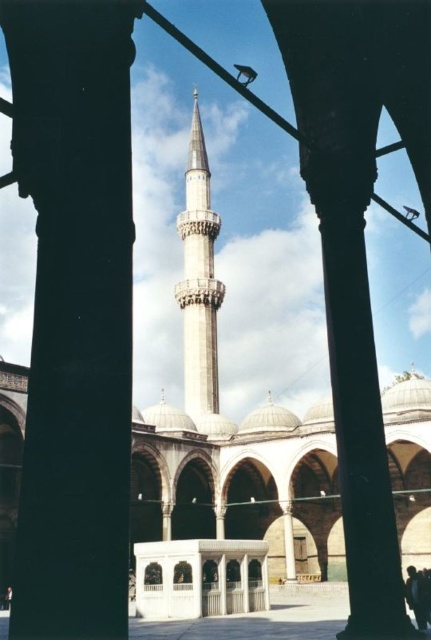
Which is in front, point (75, 461) or point (417, 572)?

Point (75, 461) is in front.

Between smooth stone pillar at center and dark hair at center, which one is positioned higher?

Positioned higher is smooth stone pillar at center.

Between point (49, 193) and point (422, 604), which one is positioned behind?

The point (422, 604) is more distant.

This screenshot has height=640, width=431. What are the coordinates of `smooth stone pillar at center` in the screenshot? It's located at (74, 312).

From the picture: Who is more forward, (187, 307) or (418, 596)?

Point (418, 596) is in front.

Who is positioned more to the right, white marble minaret at center or dark hair at center?

Positioned to the right is dark hair at center.

Between point (184, 243) and point (415, 600), which one is positioned behind?

Positioned behind is point (184, 243).

Where is `white marble minaret at center`? The height and width of the screenshot is (640, 431). white marble minaret at center is located at coordinates (199, 278).

Measure the distance between point (27,160) and camera.

Point (27,160) and camera are 23.24 meters apart from each other.

Is smooth stone pillar at center positioned in front of white marble minaret at center?

Yes, smooth stone pillar at center is in front of white marble minaret at center.

This screenshot has height=640, width=431. In order to click on smooth stone pillar at center in this screenshot , I will do pos(74,312).